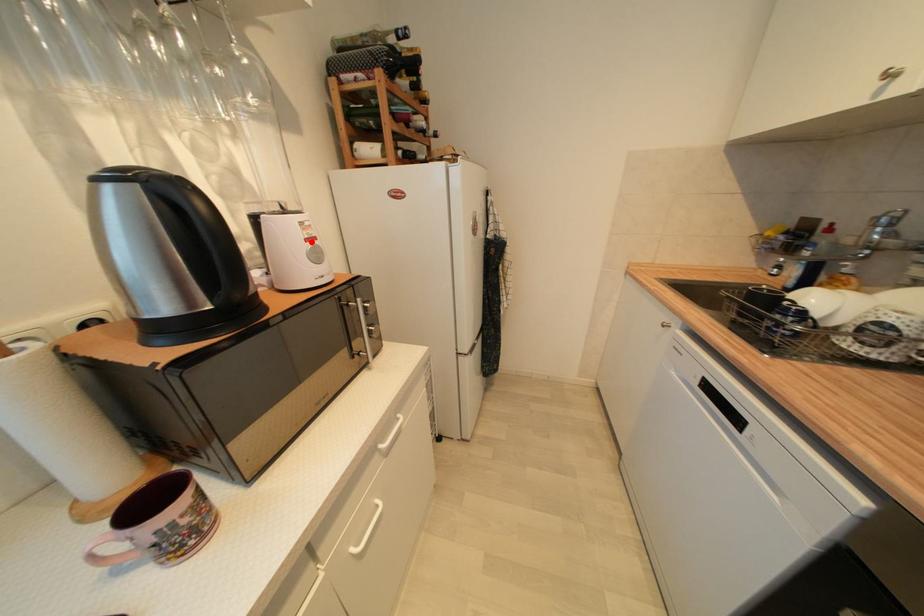
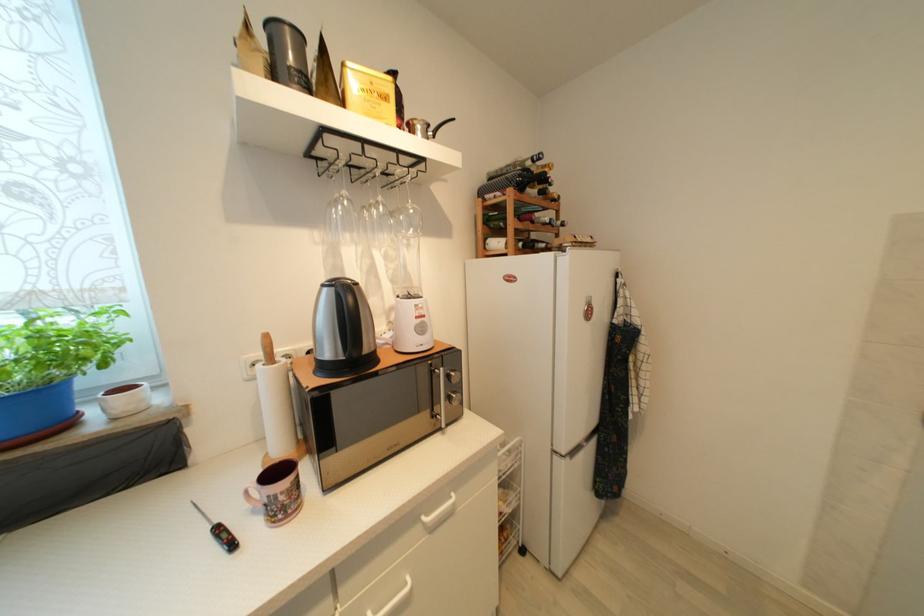
Locate, in the second image, the point that corresponds to the highlighted location in the first image.

(421, 320)